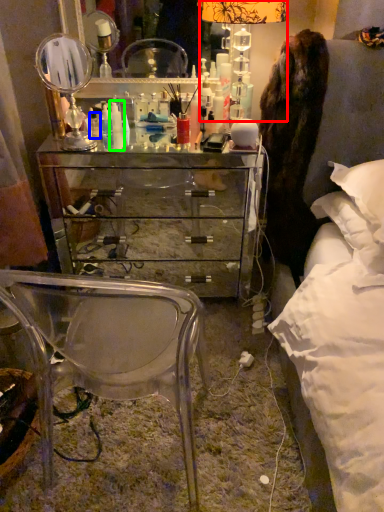
Question: Which object is positioned farthest from table lamp (highlighted by a red box)? Select from toiletry (highlighted by a blue box) and toiletry (highlighted by a green box).

Choices:
 (A) toiletry
 (B) toiletry

Answer: (A)